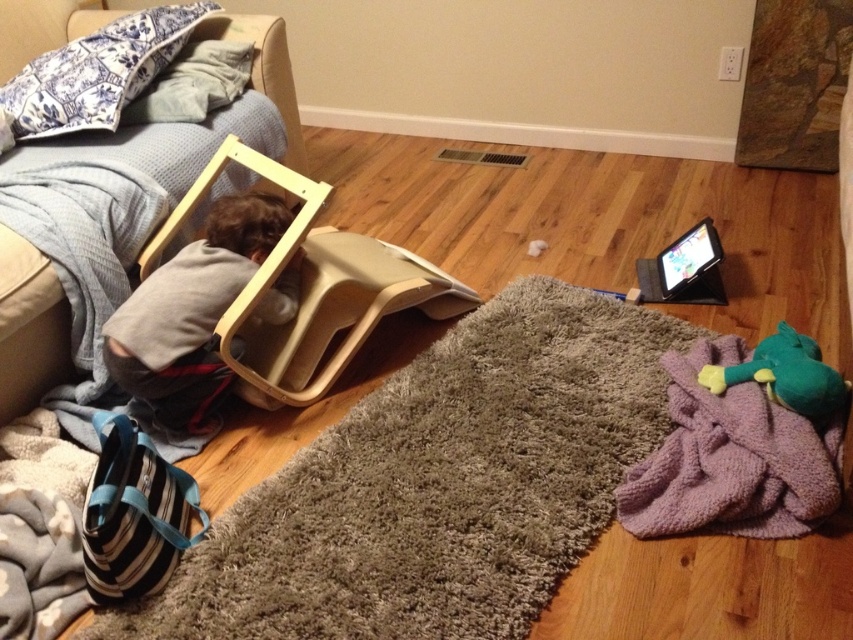
Is purple soft blanket at lower right taller than blue printed fabric pillow at upper left?

Yes.

Which is below, purple soft blanket at lower right or blue printed fabric pillow at upper left?

purple soft blanket at lower right is below.

Identify the location of purple soft blanket at lower right. (438, 486).

Does blue toile fabric pillow at upper left appear under blue printed fabric pillow at upper left?

Incorrect, blue toile fabric pillow at upper left is not positioned below blue printed fabric pillow at upper left.

Find the location of `blue toile fabric pillow at upper left`. blue toile fabric pillow at upper left is located at coordinates (96, 72).

Is point (231, 195) less distant than point (4, 314)?

No, (231, 195) is further to viewer.

Describe the element at coordinates (190, 314) in the screenshot. I see `brown furry cat at left` at that location.

Locate an element on the screen. This screenshot has height=640, width=853. brown furry cat at left is located at coordinates (190, 314).